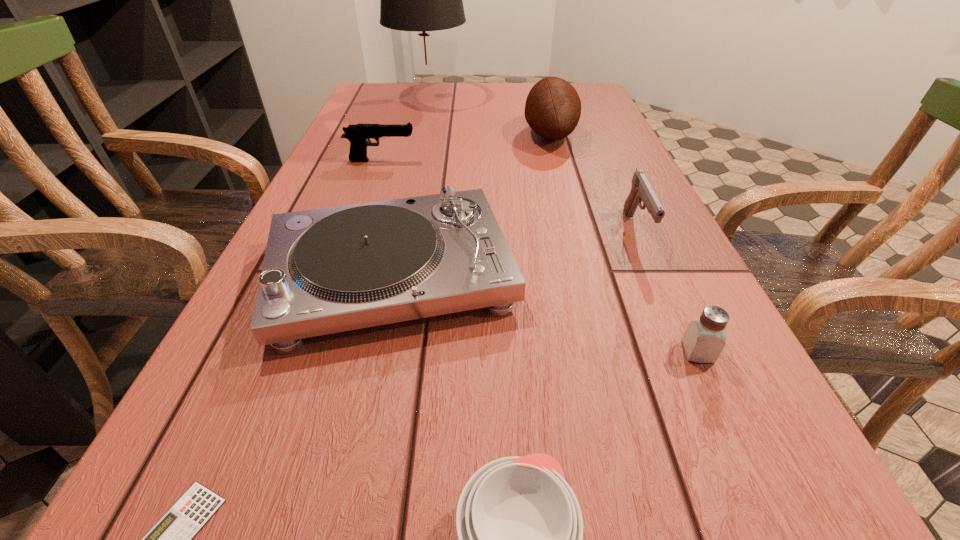
I want to click on free region located on the laces of the football, so click(386, 135).

At what (x,y) coordinates should I click in order to perform the action: click on vacant space located on the laces of the football. Please return your answer as a coordinate pair (x, y). Image resolution: width=960 pixels, height=540 pixels. Looking at the image, I should click on click(x=490, y=135).

At what (x,y) coordinates should I click in order to perform the action: click on vacant space located 0.210m on the laces of the football. Please return your answer as a coordinate pair (x, y). Image resolution: width=960 pixels, height=540 pixels. Looking at the image, I should click on (445, 135).

Locate an element on the screen. This screenshot has height=540, width=960. blank space located 0.220m at the barrel of the right pistol is located at coordinates (690, 352).

Locate an element on the screen. vacant space located 0.240m on the front-facing side of the farther pistol is located at coordinates (514, 160).

Where is `free space located 0.340m on the back of the record player`? free space located 0.340m on the back of the record player is located at coordinates click(421, 142).

Where is `vacant space located on the back of the sixth tallest object`? Image resolution: width=960 pixels, height=540 pixels. vacant space located on the back of the sixth tallest object is located at coordinates (671, 294).

You are a GUI agent. You are given a task and a screenshot of the screen. Output one action in this format:
    pyautogui.click(x=<x>, y=<y>)
    Task: Click on the object that is at the far edge
    
    Given the screenshot: What is the action you would take?
    pyautogui.click(x=419, y=0)

This screenshot has height=540, width=960. What are the coordinates of `lampshade that is at the left edge` in the screenshot? It's located at (419, 0).

The height and width of the screenshot is (540, 960). Identify the location of pistol at the left edge. (358, 134).